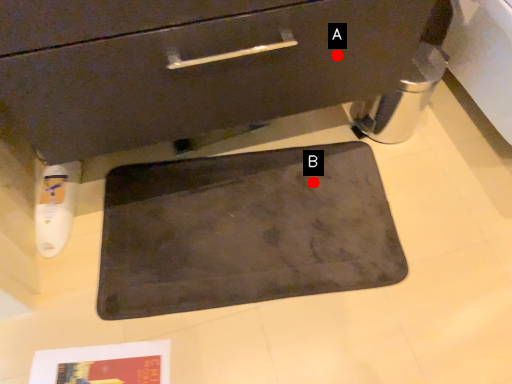
Question: Two points are circled on the image, labeled by A and B beside each circle. Which of the following is the farthest from the observer?

Choices:
 (A) A is further
 (B) B is further

Answer: (B)